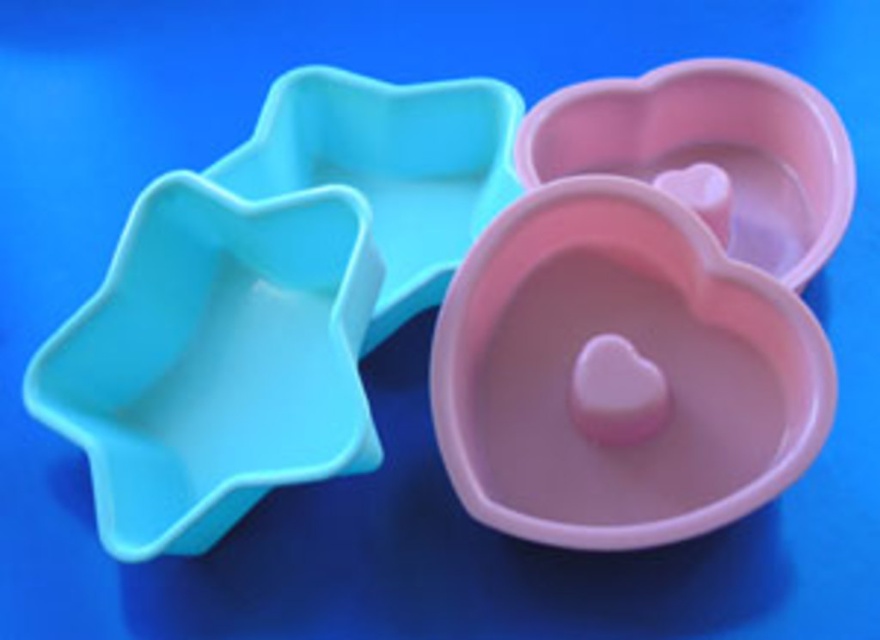
You are standing 5 feet away from the silicone molds. A point labeled as point (352,234) is located on one of the molds. Can you reach this point without moving closer than 4 feet?

The distance of point (352,234) from viewer is 4.36 feet. Since you are standing 5 feet away, you can reach it without moving closer than 4 feet because 4.36 feet is within the 4 to 5 feet range.